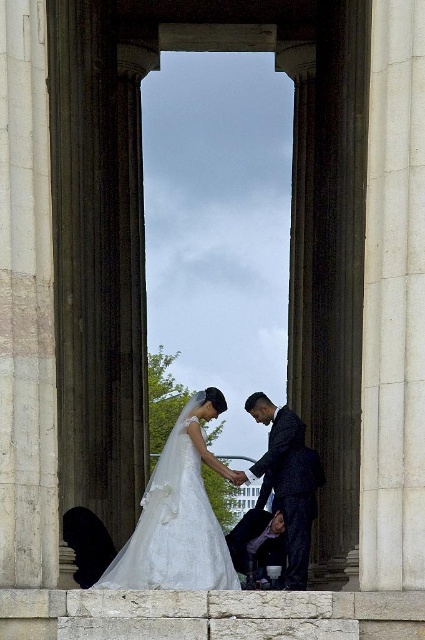
The width and height of the screenshot is (425, 640). What do you see at coordinates (288, 481) in the screenshot? I see `dark blue textured suit at center` at bounding box center [288, 481].

Looking at this image, can you confirm if dark blue textured suit at center is positioned below dark blue suit at center?

Incorrect, dark blue textured suit at center is not positioned below dark blue suit at center.

Is point (303, 538) farther from camera compared to point (243, 544)?

No, (303, 538) is closer to viewer.

In order to click on dark blue textured suit at center in this screenshot , I will do `click(288, 481)`.

Which is more to the right, white satin dress at center or dark blue textured suit at center?

dark blue textured suit at center is more to the right.

Is white satin dress at center thinner than dark blue textured suit at center?

No.

Is point (147, 509) positioned after point (297, 572)?

No, it is not.

Locate an element on the screen. This screenshot has height=640, width=425. white satin dress at center is located at coordinates (178, 515).

Who is higher up, white satin dress at center or dark blue suit at center?

white satin dress at center is above.

Is point (113, 570) in front of point (255, 560)?

Yes, it is in front of point (255, 560).

In order to click on white satin dress at center in this screenshot , I will do `click(178, 515)`.